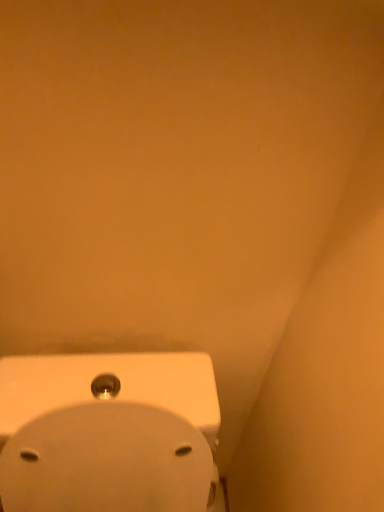
Find the location of a particular element. This screenshot has width=384, height=512. white glossy toilet at lower left is located at coordinates (108, 433).

What do you see at coordinates (108, 433) in the screenshot? I see `white glossy toilet at lower left` at bounding box center [108, 433].

The width and height of the screenshot is (384, 512). In order to click on white glossy toilet at lower left in this screenshot , I will do point(108,433).